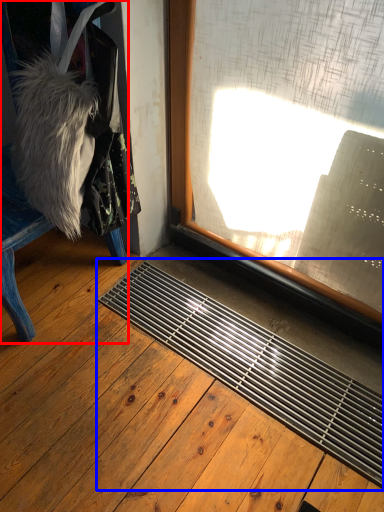
Question: Among these objects, which one is nearest to the camera, furniture (highlighted by a red box) or doormat (highlighted by a blue box)?

Choices:
 (A) furniture
 (B) doormat

Answer: (B)